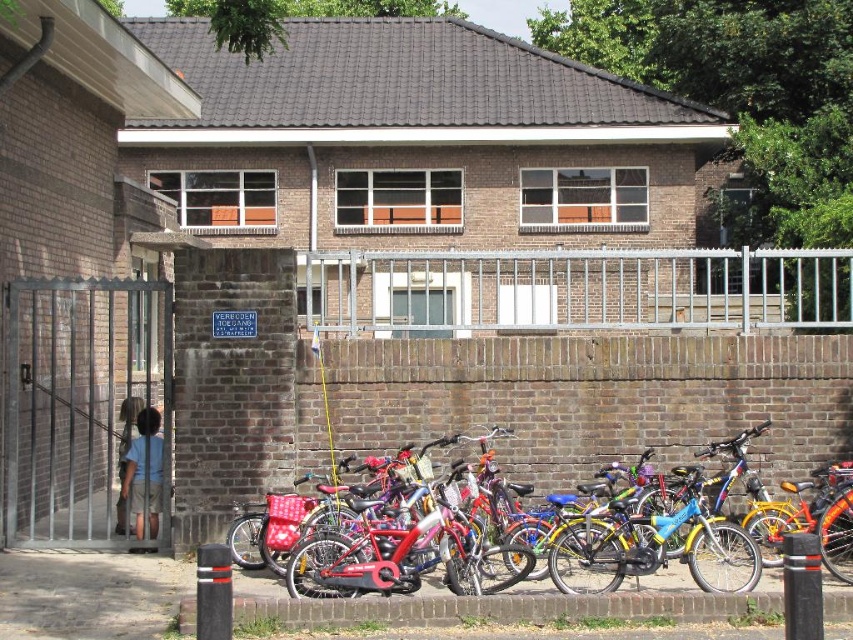
Can you confirm if silver metallic fence at center is positioned above metallic gate at left?

Indeed, silver metallic fence at center is positioned over metallic gate at left.

Is point (515, 324) positioned in front of point (144, 372)?

Yes, it is in front of point (144, 372).

The image size is (853, 640). Identify the location of silver metallic fence at center. (572, 289).

Between metallic gate at left and shiny red bicycle at center, which one appears on the right side from the viewer's perspective?

From the viewer's perspective, shiny red bicycle at center appears more on the right side.

In the scene shown: Is metallic gate at left below shiny red bicycle at center?

Yes.

Find the location of a particular element. metallic gate at left is located at coordinates (86, 412).

How far apart are silver metallic fence at center and shiny red bicycle at center?

silver metallic fence at center and shiny red bicycle at center are 6.28 meters apart.

Is point (473, 285) in front of point (715, 497)?

That is False.

Is point (573, 310) behind point (637, 481)?

Yes, it is behind point (637, 481).

Find the location of a particular element. Image resolution: width=853 pixels, height=640 pixels. silver metallic fence at center is located at coordinates [x=572, y=289].